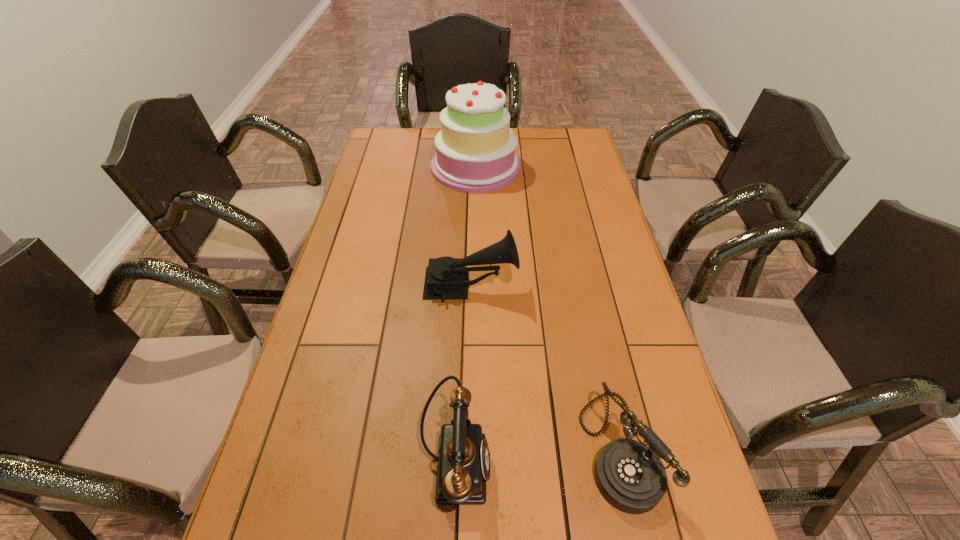
Where is `object that is at the far edge`? This screenshot has width=960, height=540. object that is at the far edge is located at coordinates (475, 149).

Where is `object positioned at the right edge`? The image size is (960, 540). object positioned at the right edge is located at coordinates (630, 476).

The image size is (960, 540). In the image, there is a desktop. Identify the location of vacant region at the far edge. (422, 143).

Find the location of `free point at the left edge`. free point at the left edge is located at coordinates (351, 359).

This screenshot has width=960, height=540. Find the location of `free space at the right edge`. free space at the right edge is located at coordinates (707, 526).

Where is `free space at the far left corner`? The width and height of the screenshot is (960, 540). free space at the far left corner is located at coordinates (402, 130).

Identify the location of vacant region at the far right corner of the desktop. (586, 140).

You are a GUI agent. You are given a task and a screenshot of the screen. Output one action in this format:
    pyautogui.click(x=<x>, y=<y>)
    Task: Click on the vacant space that is in between the right telephone and the phonograph_record
    Image resolution: width=960 pixels, height=540 pixels.
    Given the screenshot: What is the action you would take?
    (x=545, y=367)

This screenshot has width=960, height=540. In order to click on vacant point located between the second farthest object and the taller telephone in this screenshot , I will do `click(464, 375)`.

The width and height of the screenshot is (960, 540). I want to click on blank region between the farthest object and the shortest object, so click(547, 307).